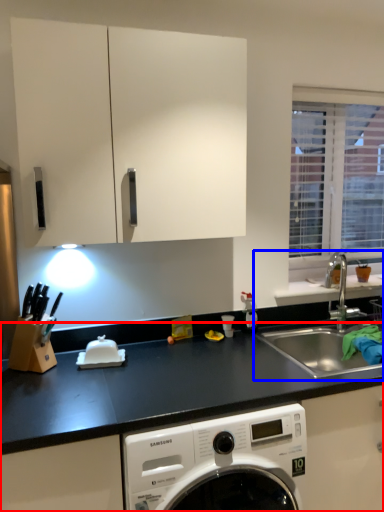
Question: Which point is further to the camera, countertop (highlighted by a red box) or sink (highlighted by a blue box)?

Choices:
 (A) countertop
 (B) sink

Answer: (B)